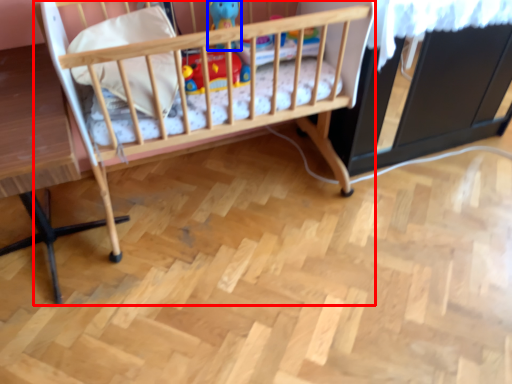
Question: Among these objects, which one is farthest to the camera, infant bed (highlighted by a red box) or toy (highlighted by a blue box)?

Choices:
 (A) infant bed
 (B) toy

Answer: (B)